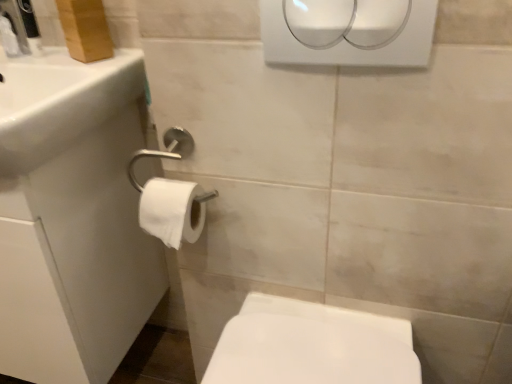
Question: Does white plastic hand dryer at upper center contain white matte toilet paper at lower left?

Choices:
 (A) yes
 (B) no

Answer: (B)

Question: Considering the relative positions of white plastic hand dryer at upper center and white matte toilet paper at lower left in the image provided, is white plastic hand dryer at upper center in front of white matte toilet paper at lower left?

Choices:
 (A) no
 (B) yes

Answer: (B)

Question: Does white plastic hand dryer at upper center have a lesser width compared to white matte toilet paper at lower left?

Choices:
 (A) yes
 (B) no

Answer: (A)

Question: Is white plastic hand dryer at upper center not close to white matte toilet paper at lower left?

Choices:
 (A) no
 (B) yes

Answer: (A)

Question: Is white plastic hand dryer at upper center at the left side of white matte toilet paper at lower left?

Choices:
 (A) no
 (B) yes

Answer: (A)

Question: Can you confirm if white plastic hand dryer at upper center is positioned to the right of white matte toilet paper at lower left?

Choices:
 (A) yes
 (B) no

Answer: (A)

Question: Does white matte toilet paper at lower left come in front of white glossy bidet at lower right?

Choices:
 (A) no
 (B) yes

Answer: (A)

Question: Does white matte toilet paper at lower left have a lesser height compared to white glossy bidet at lower right?

Choices:
 (A) yes
 (B) no

Answer: (A)

Question: Considering the relative sizes of white matte toilet paper at lower left and white glossy bidet at lower right in the image provided, is white matte toilet paper at lower left taller than white glossy bidet at lower right?

Choices:
 (A) no
 (B) yes

Answer: (A)

Question: Can white glossy bidet at lower right be found inside white matte toilet paper at lower left?

Choices:
 (A) no
 (B) yes

Answer: (A)

Question: From a real-world perspective, does white matte toilet paper at lower left stand above white glossy bidet at lower right?

Choices:
 (A) yes
 (B) no

Answer: (A)

Question: From the image's perspective, would you say white matte toilet paper at lower left is shown under white glossy bidet at lower right?

Choices:
 (A) yes
 (B) no

Answer: (B)

Question: Is white matte toilet paper at lower left bigger than white plastic hand dryer at upper center?

Choices:
 (A) yes
 (B) no

Answer: (A)